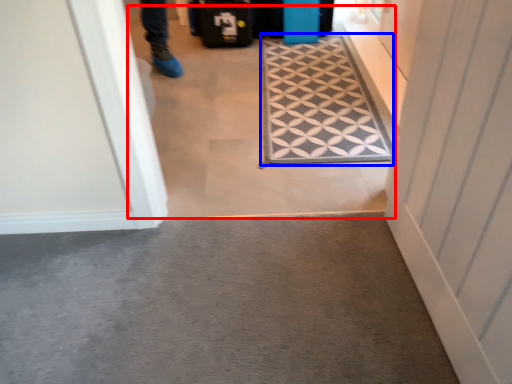
Question: Which object appears farthest to the camera in this image, passage (highlighted by a red box) or doormat (highlighted by a blue box)?

Choices:
 (A) passage
 (B) doormat

Answer: (B)